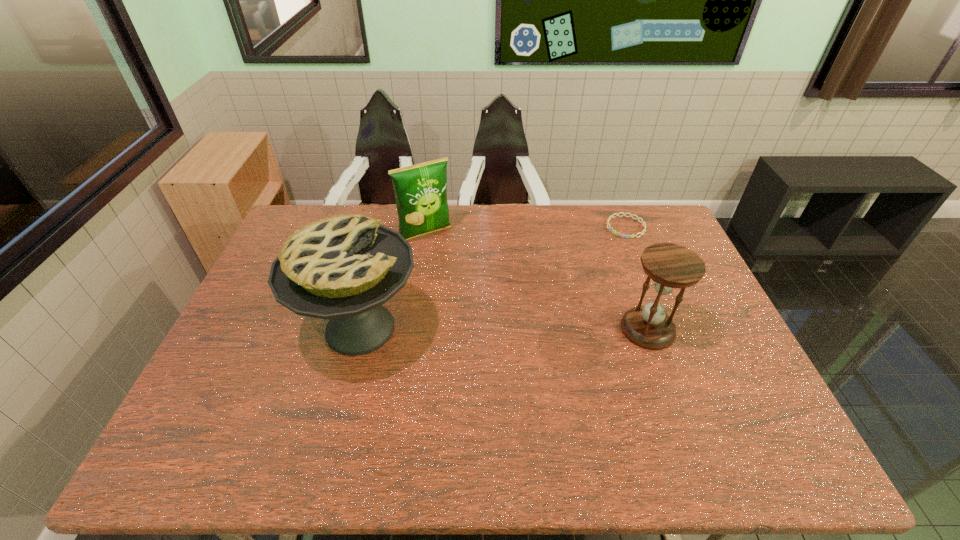
The width and height of the screenshot is (960, 540). Find the location of `free space on the desktop that is between the pie and the hourglass and is positioned on the surface of the shortest object showing star-shaped elements`. free space on the desktop that is between the pie and the hourglass and is positioned on the surface of the shortest object showing star-shaped elements is located at coordinates (545, 329).

The height and width of the screenshot is (540, 960). I want to click on vacant space on the desktop that is between the pie and the hourglass and is positioned on the front-facing side of the crisp (potato chip), so click(492, 329).